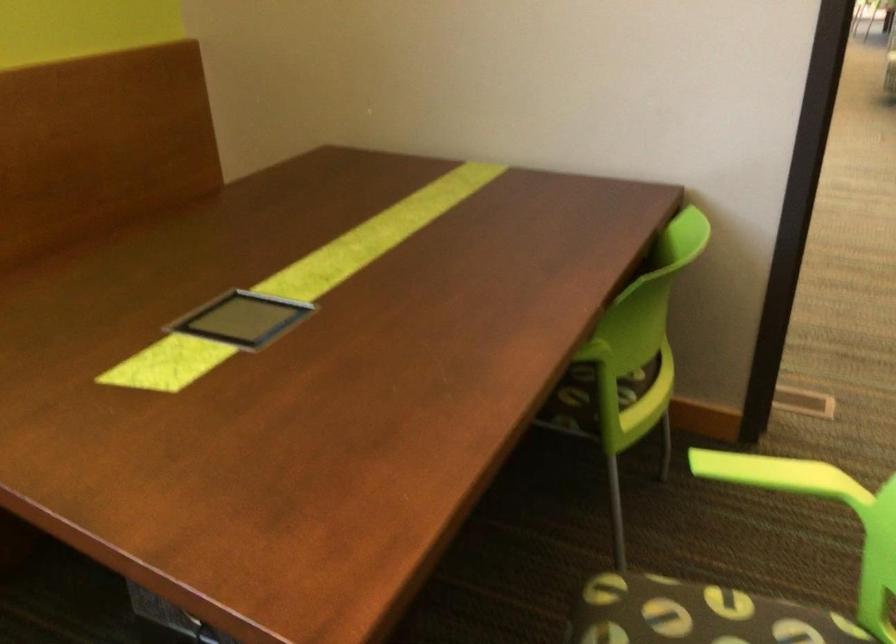
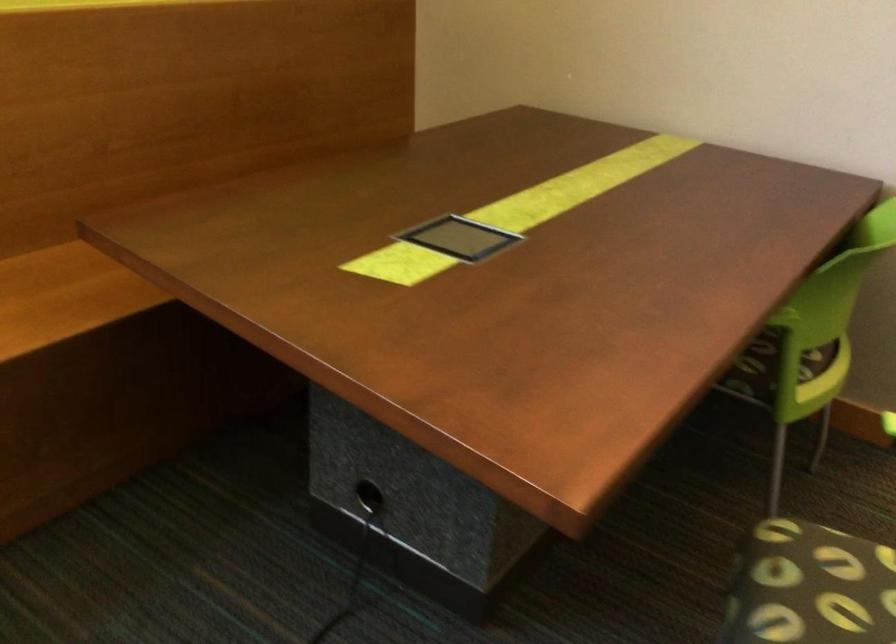
Question: The images are taken continuously from a first-person perspective. In which direction is your viewpoint rotating?

Choices:
 (A) Left
 (B) Right
 (C) Up
 (D) Down

Answer: (A)